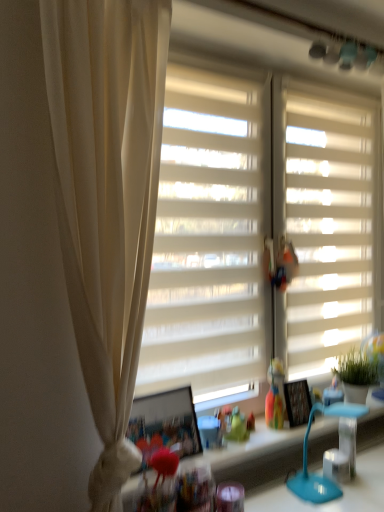
Question: Would you say white matte window blind at right is a long distance from white matte window screen at center?

Choices:
 (A) yes
 (B) no

Answer: (B)

Question: Could you tell me if white matte window blind at right is turned towards white matte window screen at center?

Choices:
 (A) no
 (B) yes

Answer: (A)

Question: Is white matte window blind at right looking in the opposite direction of white matte window screen at center?

Choices:
 (A) yes
 (B) no

Answer: (B)

Question: From the image's perspective, is white matte window blind at right over white matte window screen at center?

Choices:
 (A) no
 (B) yes

Answer: (B)

Question: From the image's perspective, is white matte window blind at right below white matte window screen at center?

Choices:
 (A) yes
 (B) no

Answer: (B)

Question: Does white matte window blind at right have a lesser height compared to white matte window screen at center?

Choices:
 (A) no
 (B) yes

Answer: (B)

Question: Considering the relative sizes of translucent plastic toy at center and matte blue table lamp at lower right in the image provided, is translucent plastic toy at center smaller than matte blue table lamp at lower right?

Choices:
 (A) yes
 (B) no

Answer: (A)

Question: From the image's perspective, is translucent plastic toy at center located above matte blue table lamp at lower right?

Choices:
 (A) yes
 (B) no

Answer: (A)

Question: Is translucent plastic toy at center facing towards matte blue table lamp at lower right?

Choices:
 (A) yes
 (B) no

Answer: (A)

Question: Does translucent plastic toy at center have a lesser width compared to matte blue table lamp at lower right?

Choices:
 (A) no
 (B) yes

Answer: (B)

Question: Can you confirm if translucent plastic toy at center is taller than matte blue table lamp at lower right?

Choices:
 (A) no
 (B) yes

Answer: (A)

Question: Considering the relative sizes of translucent plastic toy at center and matte blue table lamp at lower right in the image provided, is translucent plastic toy at center wider than matte blue table lamp at lower right?

Choices:
 (A) no
 (B) yes

Answer: (A)

Question: Is white matte window screen at center positioned with its back to translucent plastic toy at center?

Choices:
 (A) yes
 (B) no

Answer: (A)